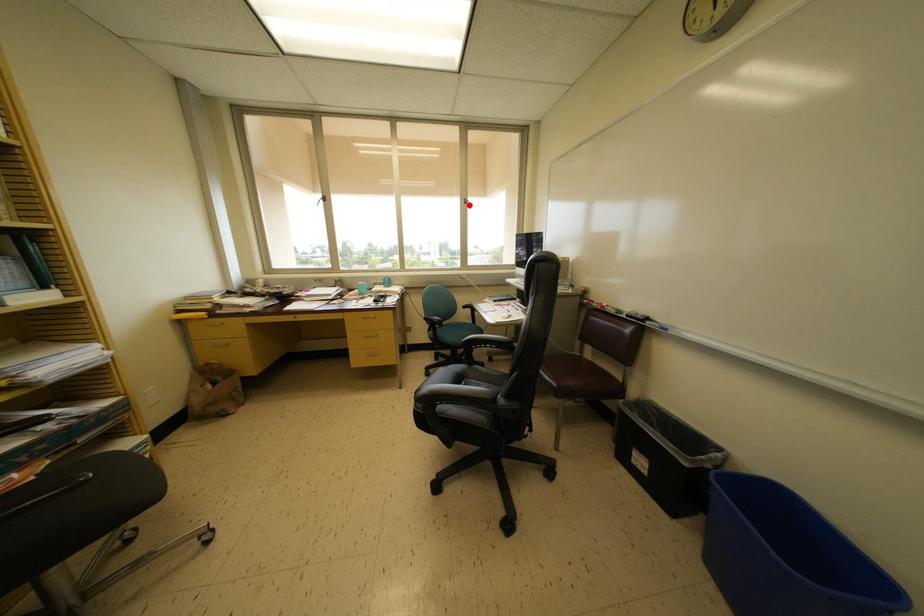
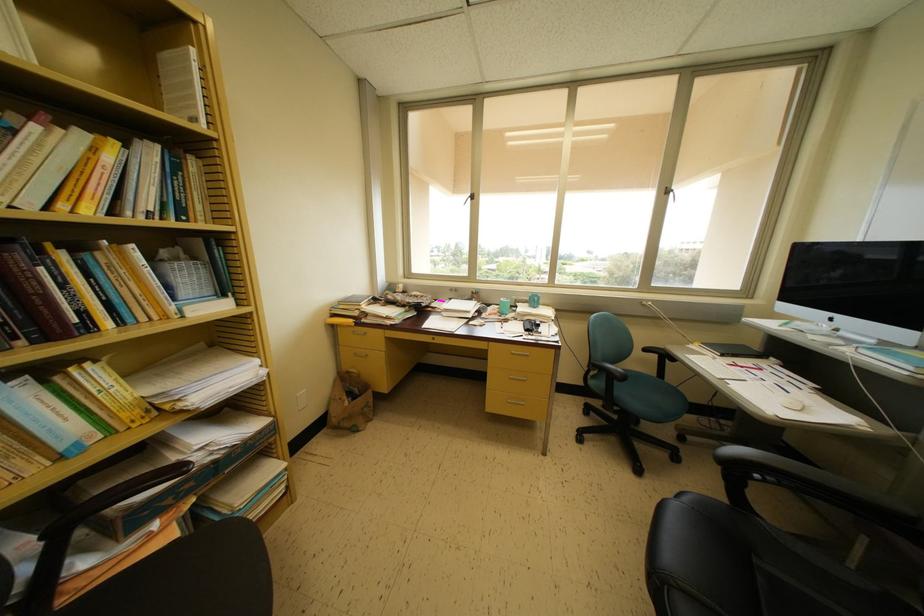
Question: A red point is marked in image1. In image2, is the corresponding 3D point closer to the camera or farther? Reply with the corresponding letter.

Choices:
 (A) The corresponding 3D point is closer.
 (B) The corresponding 3D point is farther.

Answer: (B)